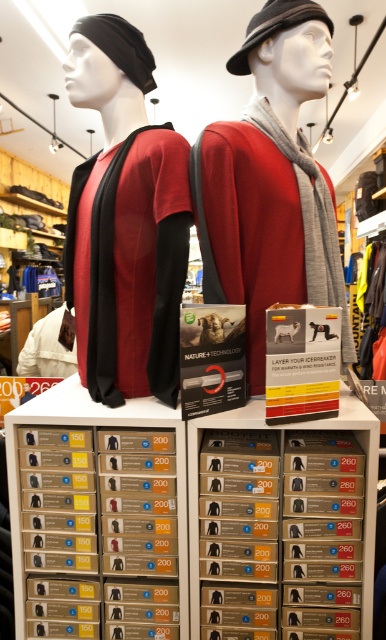
You are a customer standing in front of the retail display. You want to pick up the gray wool scarf at center. Can you reach it without moving your feet? Your outstretched hand can reach up to 1.1 meters.

The gray wool scarf at center is 1.17 meters away from the viewer. Since your outstretched hand can only reach up to 1.1 meters, you cannot reach the gray wool scarf at center without moving your feet.